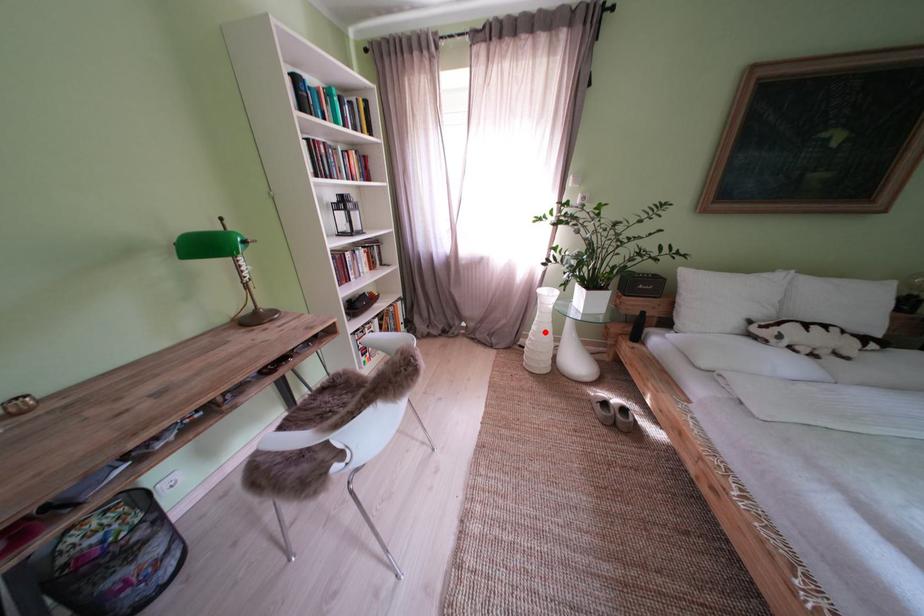
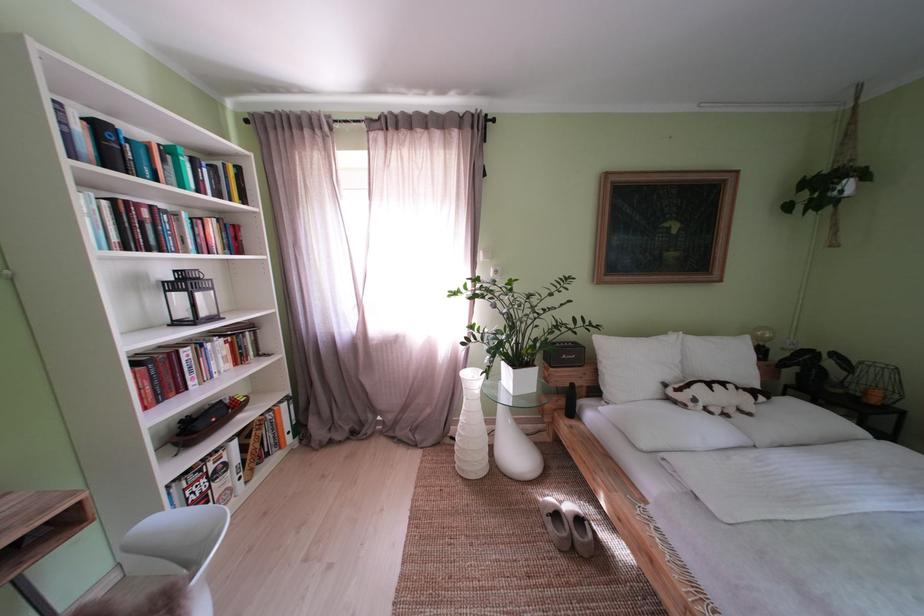
Find the pixel in the second image that matches the highlighted location in the first image.

(472, 424)